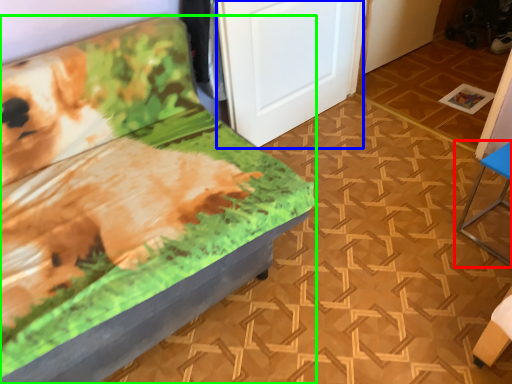
Question: Which is nearer to the furniture (highlighted by a red box)? door (highlighted by a blue box) or furniture (highlighted by a green box).

Choices:
 (A) door
 (B) furniture

Answer: (A)